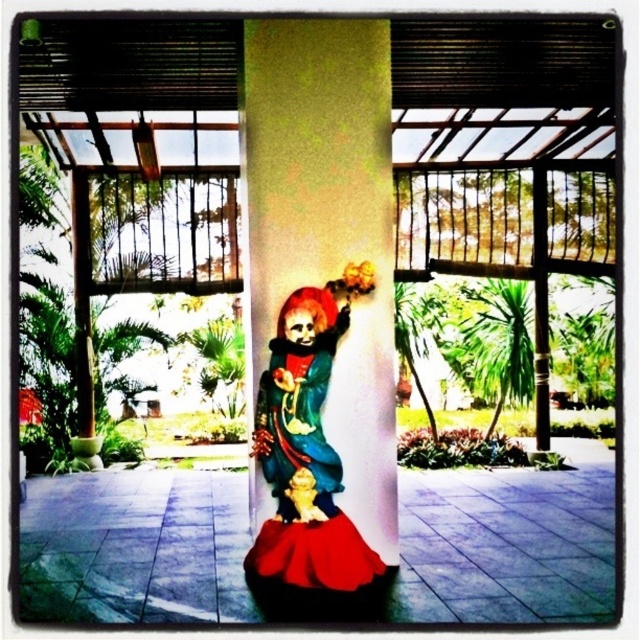
You are planning to place a new decorative pot that is 1 meter wide between the matte red dress at center and the gold metallic statue at center. Based on their widths, will the pot fit between them?

The matte red dress at center is wider than the gold metallic statue at center. However, the exact distance between them isn

You are a painter standing in front of the statue and want to paint the matte yellow pillar at center and the matte red dress at center. Which object should you look up to paint first?

The matte yellow pillar at center is located above the matte red dress at center, so you should look up to paint the matte yellow pillar at center first.